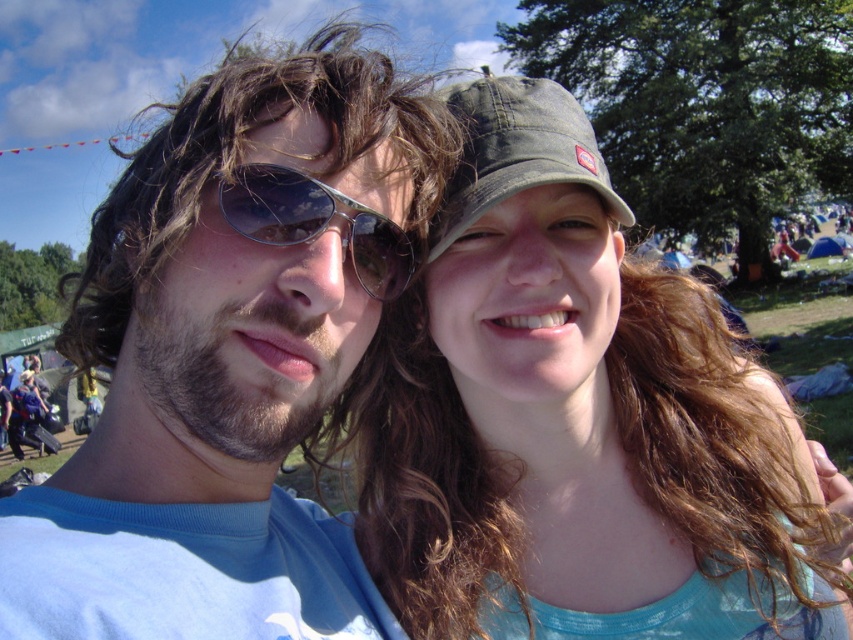
You are a photographer adjusting your camera settings. You notice the green matte baseball cap at upper right and the sunglasses at center. Which object should you zoom in on to capture more details if you want to focus on the larger one?

The green matte baseball cap at upper right is wider than the sunglasses at center, so you should zoom in on the green matte baseball cap at upper right to capture more details.